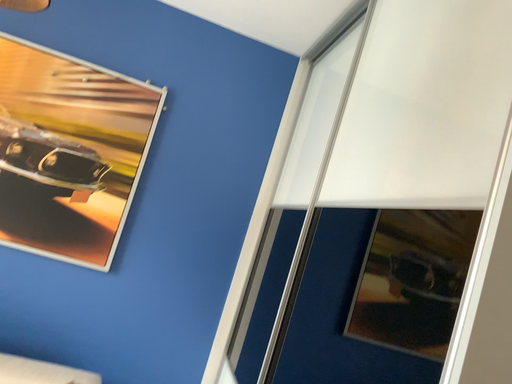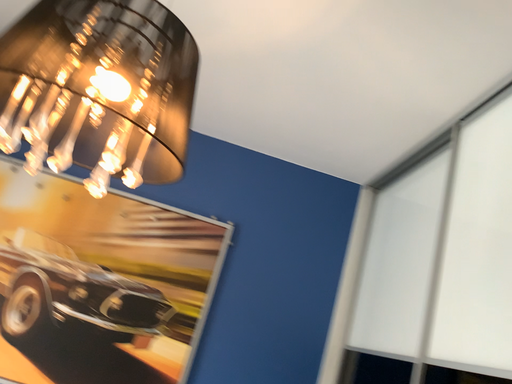
Question: How did the camera likely rotate when shooting the video?

Choices:
 (A) rotated downward
 (B) rotated upward

Answer: (B)